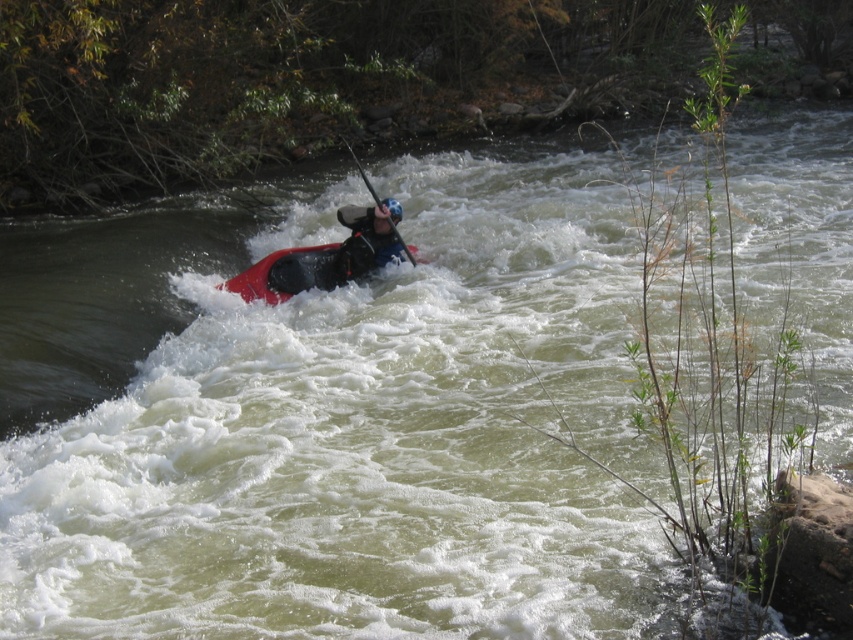
Question: Observing the image, what is the correct spatial positioning of matte black kayak at center in reference to smooth black paddle at center?

Choices:
 (A) below
 (B) above

Answer: (A)

Question: Which point appears closest to the camera in this image?

Choices:
 (A) pyautogui.click(x=328, y=260)
 (B) pyautogui.click(x=363, y=180)
 (C) pyautogui.click(x=303, y=260)

Answer: (C)

Question: Which point is closer to the camera?

Choices:
 (A) matte black kayak at center
 (B) matte red kayak at center

Answer: (B)

Question: Does matte black kayak at center have a smaller size compared to smooth black paddle at center?

Choices:
 (A) no
 (B) yes

Answer: (B)

Question: Is matte black kayak at center positioned at the back of matte red kayak at center?

Choices:
 (A) yes
 (B) no

Answer: (A)

Question: Among these points, which one is farthest from the camera?

Choices:
 (A) (326, 244)
 (B) (369, 189)
 (C) (374, 268)

Answer: (B)